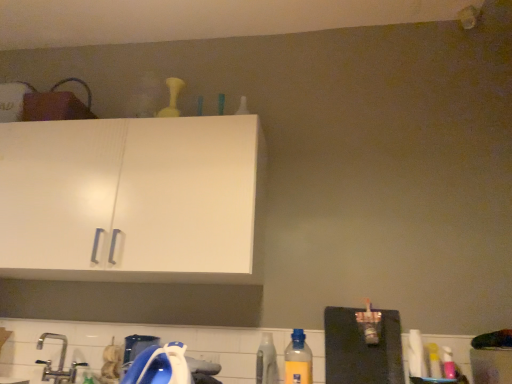
You are a GUI agent. You are given a task and a screenshot of the screen. Output one action in this format:
    pyautogui.click(x=<x>, y=<y>)
    Task: Click on the translucent plastic bottle at lower center, which is the 2th bottle from back to front
    This screenshot has height=384, width=512.
    Given the screenshot: What is the action you would take?
    pyautogui.click(x=266, y=361)

From a real-world perspective, is yellow matte bottle at upper center, marked as the first bottle in a left-to-right arrangement, below silver metallic faucet at lower left?

No, from a real-world perspective, yellow matte bottle at upper center, marked as the first bottle in a left-to-right arrangement, is not beneath silver metallic faucet at lower left.

What are the coordinates of `bottle located behind the silver metallic faucet at lower left` in the screenshot? It's located at (172, 98).

From the picture: From the image's perspective, between yellow matte bottle at upper center, the third bottle positioned from the bottom, and silver metallic faucet at lower left, which one is located above?

yellow matte bottle at upper center, the third bottle positioned from the bottom, appears higher in the image.

Measure the distance between yellow matte bottle at upper center, the first bottle in the top-to-bottom sequence, and silver metallic faucet at lower left.

yellow matte bottle at upper center, the first bottle in the top-to-bottom sequence, is 4.36 feet from silver metallic faucet at lower left.

From the image's perspective, is yellow matte bottle at upper center, marked as the first bottle in a left-to-right arrangement, above yellow plastic bottle at lower center, arranged as the 3th bottle when viewed from the back?

Yes, from the image's perspective, yellow matte bottle at upper center, marked as the first bottle in a left-to-right arrangement, is over yellow plastic bottle at lower center, arranged as the 3th bottle when viewed from the back.

Considering the sizes of yellow matte bottle at upper center, placed as the 3th bottle when sorted from front to back, and yellow plastic bottle at lower center, which is the second bottle from bottom to top, in the image, is yellow matte bottle at upper center, placed as the 3th bottle when sorted from front to back, bigger or smaller than yellow plastic bottle at lower center, which is the second bottle from bottom to top,?

yellow matte bottle at upper center, placed as the 3th bottle when sorted from front to back, is bigger than yellow plastic bottle at lower center, which is the second bottle from bottom to top.

Which is farther from the camera, (170, 85) or (302, 375)?

The point (170, 85) is more distant.

Is yellow matte bottle at upper center, which is counted as the 1th bottle, starting from the back, outside of yellow plastic bottle at lower center, the 1th bottle positioned from the front?

Yes, yellow matte bottle at upper center, which is counted as the 1th bottle, starting from the back, is not within yellow plastic bottle at lower center, the 1th bottle positioned from the front.

Is silver metallic faucet at lower left oriented towards yellow matte bottle at upper center, the 3th bottle when ordered from right to left?

No, silver metallic faucet at lower left is not facing towards yellow matte bottle at upper center, the 3th bottle when ordered from right to left.

Is silver metallic faucet at lower left surrounding yellow matte bottle at upper center, the first bottle in the top-to-bottom sequence?

Definitely not — yellow matte bottle at upper center, the first bottle in the top-to-bottom sequence, is not inside silver metallic faucet at lower left.

Is silver metallic faucet at lower left with yellow matte bottle at upper center, placed as the 3th bottle when sorted from front to back?

No, silver metallic faucet at lower left is not in contact with yellow matte bottle at upper center, placed as the 3th bottle when sorted from front to back.

Looking at their sizes, would you say silver metallic faucet at lower left is wider or thinner than yellow matte bottle at upper center, the third bottle positioned from the bottom?

Considering their sizes, silver metallic faucet at lower left looks broader than yellow matte bottle at upper center, the third bottle positioned from the bottom.

Does yellow plastic bottle at lower center, the 1th bottle in the right-to-left sequence, appear on the right side of silver metallic faucet at lower left?

Yes.

Considering the points (295, 378) and (42, 377), which point is behind, point (295, 378) or point (42, 377)?

The point (42, 377) is farther from the camera.

Is yellow plastic bottle at lower center, the 1th bottle in the right-to-left sequence, in front of or behind silver metallic faucet at lower left in the image?

Clearly, yellow plastic bottle at lower center, the 1th bottle in the right-to-left sequence, is in front of silver metallic faucet at lower left.

Is yellow plastic bottle at lower center, the 1th bottle positioned from the front, aimed at silver metallic faucet at lower left?

No.

Is yellow matte bottle at upper center, the first bottle in the top-to-bottom sequence, outside of translucent plastic bottle at lower center, placed as the first bottle when sorted from bottom to top?

That's correct, yellow matte bottle at upper center, the first bottle in the top-to-bottom sequence, is outside of translucent plastic bottle at lower center, placed as the first bottle when sorted from bottom to top.

The width and height of the screenshot is (512, 384). What are the coordinates of `the 2nd bottle positioned below the yellow matte bottle at upper center, the 3th bottle when ordered from right to left (from a real-world perspective)` in the screenshot? It's located at (266, 361).

Considering the relative sizes of yellow matte bottle at upper center, the first bottle in the top-to-bottom sequence, and translucent plastic bottle at lower center, which is counted as the second bottle, starting from the left, in the image provided, is yellow matte bottle at upper center, the first bottle in the top-to-bottom sequence, thinner than translucent plastic bottle at lower center, which is counted as the second bottle, starting from the left,?

Yes.

Is yellow matte bottle at upper center, the 3th bottle when ordered from right to left, looking in the opposite direction of translucent plastic bottle at lower center, the 2th bottle in the front-to-back sequence?

No, yellow matte bottle at upper center, the 3th bottle when ordered from right to left,'s orientation is not away from translucent plastic bottle at lower center, the 2th bottle in the front-to-back sequence.

Is translucent plastic bottle at lower center, placed as the first bottle when sorted from bottom to top, aimed at yellow matte bottle at upper center, which is counted as the 1th bottle, starting from the back?

No, translucent plastic bottle at lower center, placed as the first bottle when sorted from bottom to top, is not oriented towards yellow matte bottle at upper center, which is counted as the 1th bottle, starting from the back.

In the scene shown: Which is closer to the camera, (262, 372) or (161, 114)?

Point (262, 372) is closer to the camera than point (161, 114).

How many degrees apart are the facing directions of translucent plastic bottle at lower center, which is counted as the second bottle, starting from the left, and yellow matte bottle at upper center, the 3th bottle when ordered from right to left?

The angular difference between translucent plastic bottle at lower center, which is counted as the second bottle, starting from the left, and yellow matte bottle at upper center, the 3th bottle when ordered from right to left, is 2.36 degrees.

Identify the location of the 2nd bottle positioned above the translucent plastic bottle at lower center, placed as the first bottle when sorted from bottom to top (from a real-world perspective). (172, 98).

From the image's perspective, which one is positioned lower, yellow plastic bottle at lower center, which is counted as the third bottle, starting from the left, or yellow matte bottle at upper center, the 3th bottle when ordered from right to left?

yellow plastic bottle at lower center, which is counted as the third bottle, starting from the left, appears lower in the image.

How far apart are yellow plastic bottle at lower center, the 1th bottle in the right-to-left sequence, and yellow matte bottle at upper center, the first bottle in the top-to-bottom sequence?

yellow plastic bottle at lower center, the 1th bottle in the right-to-left sequence, is 4.91 feet from yellow matte bottle at upper center, the first bottle in the top-to-bottom sequence.

Considering the relative sizes of yellow plastic bottle at lower center, arranged as the 3th bottle when viewed from the back, and yellow matte bottle at upper center, the third bottle positioned from the bottom, in the image provided, is yellow plastic bottle at lower center, arranged as the 3th bottle when viewed from the back, thinner than yellow matte bottle at upper center, the third bottle positioned from the bottom,?

Yes, yellow plastic bottle at lower center, arranged as the 3th bottle when viewed from the back, is thinner than yellow matte bottle at upper center, the third bottle positioned from the bottom.

Considering the relative positions of yellow plastic bottle at lower center, the 1th bottle positioned from the front, and yellow matte bottle at upper center, which is counted as the 1th bottle, starting from the back, in the image provided, is yellow plastic bottle at lower center, the 1th bottle positioned from the front, in front of yellow matte bottle at upper center, which is counted as the 1th bottle, starting from the back,?

Yes, it is.

Locate an element on the screen. faucet below the yellow matte bottle at upper center, marked as the first bottle in a left-to-right arrangement (from a real-world perspective) is located at coordinates (59, 362).

At what (x,y) coordinates should I click in order to perform the action: click on bottle located above the yellow plastic bottle at lower center, the 1th bottle in the right-to-left sequence (from a real-world perspective). Please return your answer as a coordinate pair (x, y). The image size is (512, 384). Looking at the image, I should click on (172, 98).

Estimate the real-world distances between objects in this image. Which object is further from yellow matte bottle at upper center, marked as the first bottle in a left-to-right arrangement, translucent plastic bottle at lower center, the 2th bottle positioned from the right, or silver metallic faucet at lower left?

Among the two, translucent plastic bottle at lower center, the 2th bottle positioned from the right, is located further to yellow matte bottle at upper center, marked as the first bottle in a left-to-right arrangement.

Considering their positions, is yellow matte bottle at upper center, the first bottle in the top-to-bottom sequence, positioned further to yellow plastic bottle at lower center, which is counted as the third bottle, starting from the left, than silver metallic faucet at lower left?

yellow matte bottle at upper center, the first bottle in the top-to-bottom sequence, is further to yellow plastic bottle at lower center, which is counted as the third bottle, starting from the left.

Estimate the real-world distances between objects in this image. Which object is further from translucent plastic bottle at lower center, which is counted as the second bottle, starting from the left, yellow matte bottle at upper center, the 3th bottle when ordered from right to left, or silver metallic faucet at lower left?

yellow matte bottle at upper center, the 3th bottle when ordered from right to left, is further to translucent plastic bottle at lower center, which is counted as the second bottle, starting from the left.

Looking at this image, estimate the real-world distances between objects in this image. Which object is further from yellow matte bottle at upper center, placed as the 3th bottle when sorted from front to back, silver metallic faucet at lower left or yellow plastic bottle at lower center, arranged as the 3th bottle when viewed from the back?

Among the two, yellow plastic bottle at lower center, arranged as the 3th bottle when viewed from the back, is located further to yellow matte bottle at upper center, placed as the 3th bottle when sorted from front to back.

Looking at the image, which one is located further to translucent plastic bottle at lower center, placed as the 3th bottle when sorted from top to bottom, yellow plastic bottle at lower center, which is counted as the third bottle, starting from the left, or silver metallic faucet at lower left?

The object further to translucent plastic bottle at lower center, placed as the 3th bottle when sorted from top to bottom, is silver metallic faucet at lower left.

From the image, which object appears to be nearer to yellow matte bottle at upper center, the first bottle in the top-to-bottom sequence, yellow plastic bottle at lower center, the 1th bottle positioned from the front, or silver metallic faucet at lower left?

silver metallic faucet at lower left lies closer to yellow matte bottle at upper center, the first bottle in the top-to-bottom sequence, than the other object.

Looking at this image, looking at the image, which one is located further to yellow matte bottle at upper center, placed as the 3th bottle when sorted from front to back, silver metallic faucet at lower left or translucent plastic bottle at lower center, which is the 2th bottle from back to front?

translucent plastic bottle at lower center, which is the 2th bottle from back to front.

Looking at the image, which one is located further to silver metallic faucet at lower left, translucent plastic bottle at lower center, which is counted as the second bottle, starting from the left, or yellow plastic bottle at lower center, the 1th bottle in the right-to-left sequence?

yellow plastic bottle at lower center, the 1th bottle in the right-to-left sequence, is further to silver metallic faucet at lower left.

Locate an element on the screen. This screenshot has width=512, height=384. bottle between yellow matte bottle at upper center, marked as the first bottle in a left-to-right arrangement, and translucent plastic bottle at lower center, placed as the 3th bottle when sorted from top to bottom, from top to bottom is located at coordinates (298, 360).